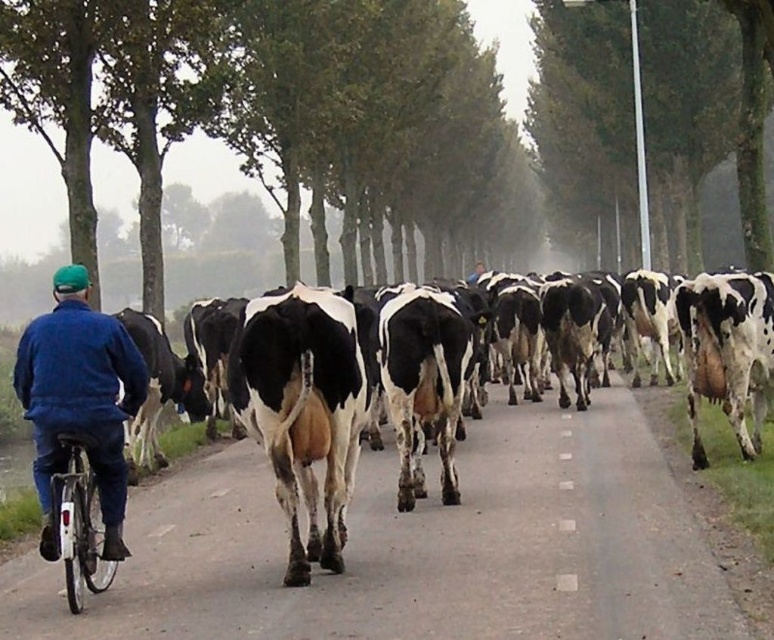
Can you confirm if blue fleece jacket at left is taller than silver metallic bicycle at lower left?

Correct, blue fleece jacket at left is much taller as silver metallic bicycle at lower left.

Between blue fleece jacket at left and silver metallic bicycle at lower left, which one has less height?

silver metallic bicycle at lower left is shorter.

Is point (57, 365) closer to camera compared to point (98, 513)?

Yes.

Locate an element on the screen. blue fleece jacket at left is located at coordinates (79, 400).